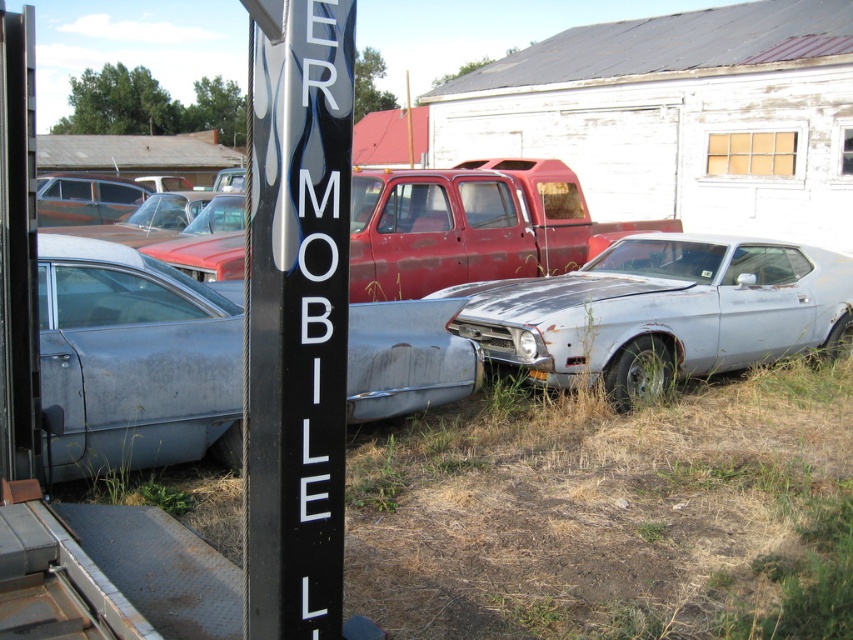
You are a delivery person needing to place a 3 meter long box between the black plastic sign at center and the rusty metal car at center. Is there enough space to fit the box between them?

The black plastic sign at center and the rusty metal car at center are 2.76 meters apart from each other. Since the box is 3 meters long, it is 0.24 meters too long to fit between them.

You are a photographer trying to capture both the rusty metal car at center and the rusty metal car at left in a single shot. Can you position yourself so that neither car is blocking the other?

The rusty metal car at center is positioned under the rusty metal car at left, so no, you cannot position yourself to capture both without one blocking the other.